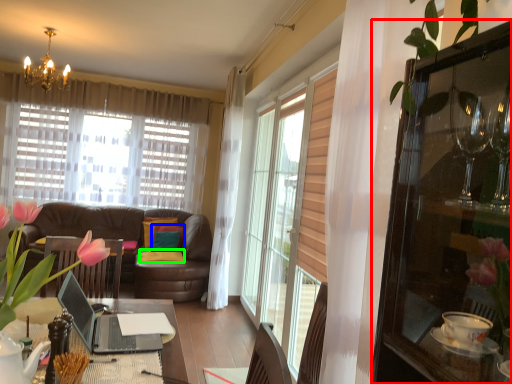
Question: Which is farther away from cabinetry (highlighted by a red box)? pillow (highlighted by a blue box) or pillow (highlighted by a green box)?

Choices:
 (A) pillow
 (B) pillow

Answer: (A)